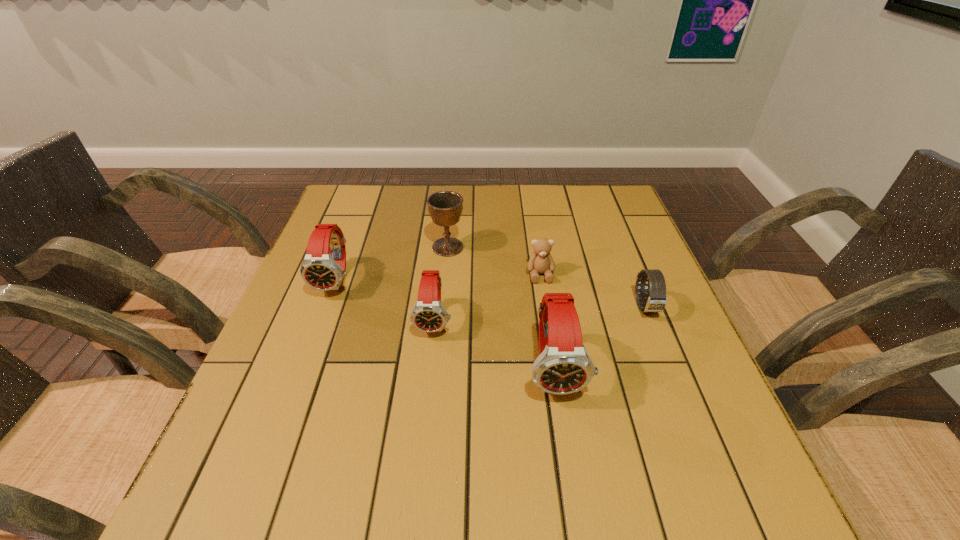
Considering the uniform spacing of watchs, where should an additional watch be positioned on the right? Please locate a free spot. Please provide its 2D coordinates. Your answer should be formatted as a tuple, i.e. [(x, y)], where the tuple contains the x and y coordinates of a point satisfying the conditions above.

[(706, 431)]